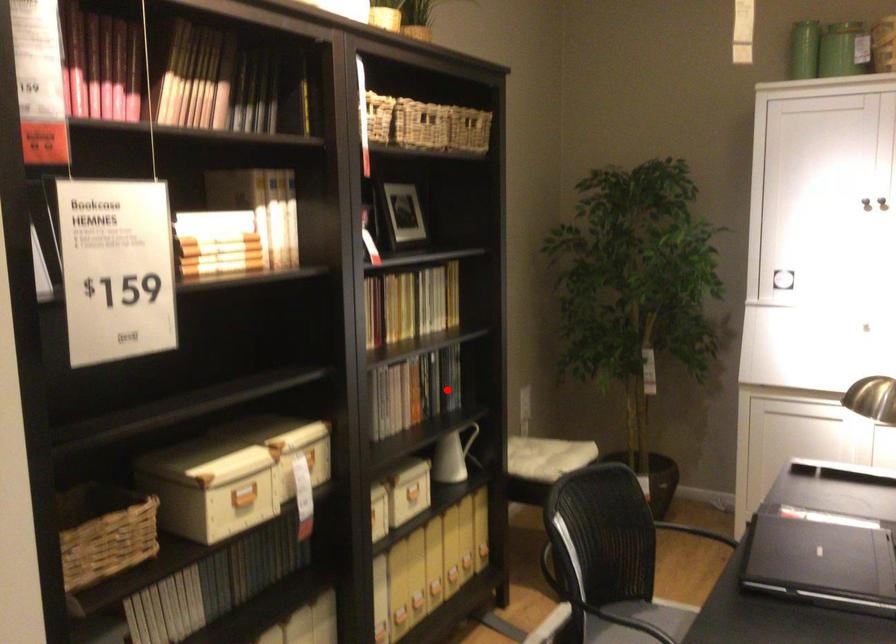
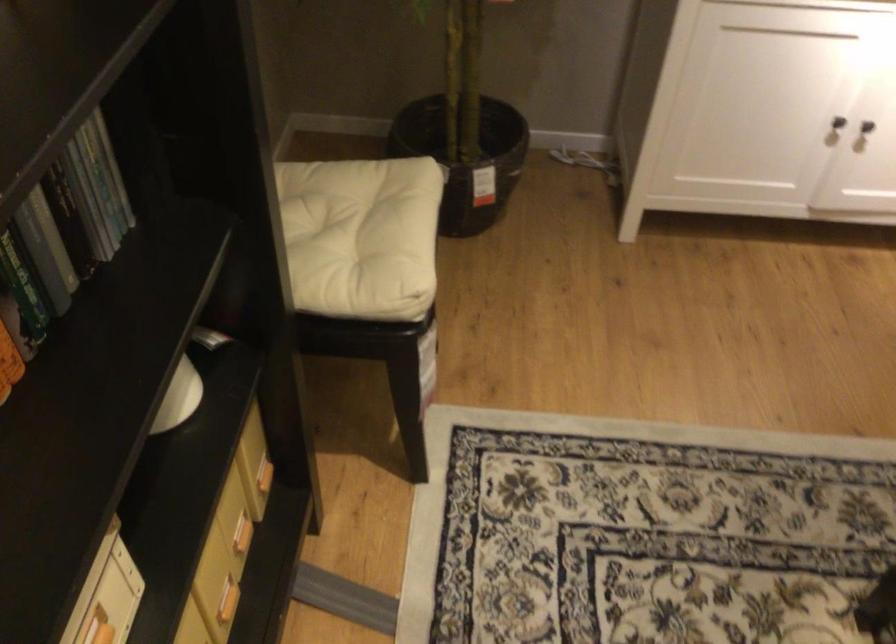
Find the pixel in the second image that matches the highlighted location in the first image.

(95, 198)